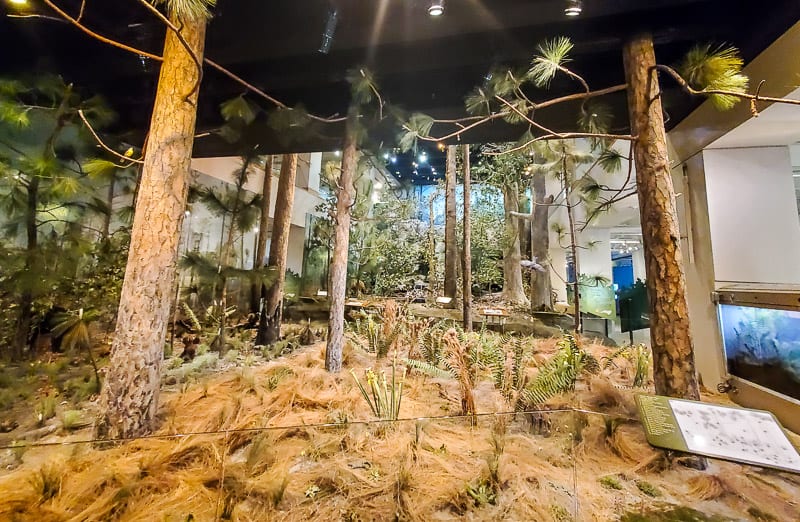
The height and width of the screenshot is (522, 800). In order to click on aquarium in this screenshot , I will do `click(746, 335)`.